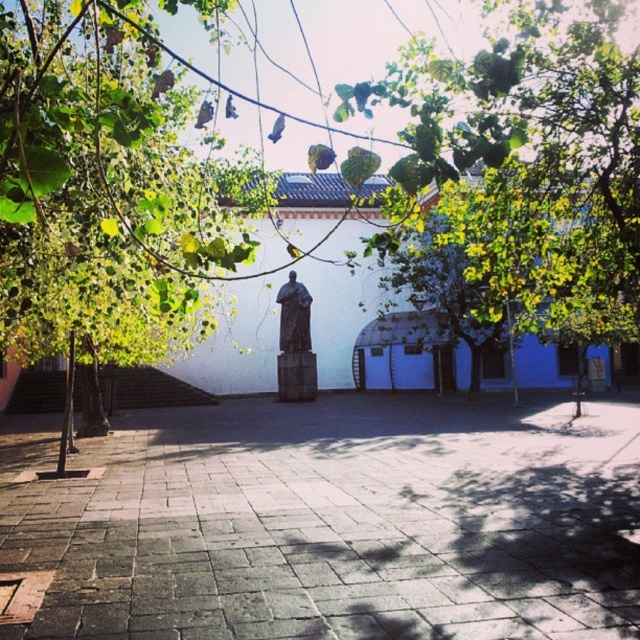
Who is more forward, (627, 435) or (294, 349)?

Point (627, 435)

Can you confirm if gray stone pavement at center is wider than bronze statue at center?

Yes, gray stone pavement at center is wider than bronze statue at center.

Is point (406, 637) in front of point (292, 300)?

Yes, it is.

The width and height of the screenshot is (640, 640). Find the location of `gray stone pavement at center`. gray stone pavement at center is located at coordinates (340, 524).

Can you confirm if gray stone pavement at center is taller than green leafy tree at center?

No, gray stone pavement at center is not taller than green leafy tree at center.

From the picture: Which is below, gray stone pavement at center or green leafy tree at center?

gray stone pavement at center is lower down.

Is point (372, 598) behind point (476, 54)?

No, (372, 598) is closer to viewer.

The width and height of the screenshot is (640, 640). I want to click on gray stone pavement at center, so click(x=340, y=524).

Is the position of green leafy tree at center less distant than that of bronze statue at center?

Yes.

Who is more forward, (548,257) or (307,294)?

Point (548,257)

You are a GUI agent. You are given a task and a screenshot of the screen. Output one action in this format:
    pyautogui.click(x=<x>, y=<y>)
    Task: Click on the green leafy tree at center
    Image resolution: width=640 pixels, height=640 pixels.
    Given the screenshot: What is the action you would take?
    pyautogui.click(x=529, y=164)